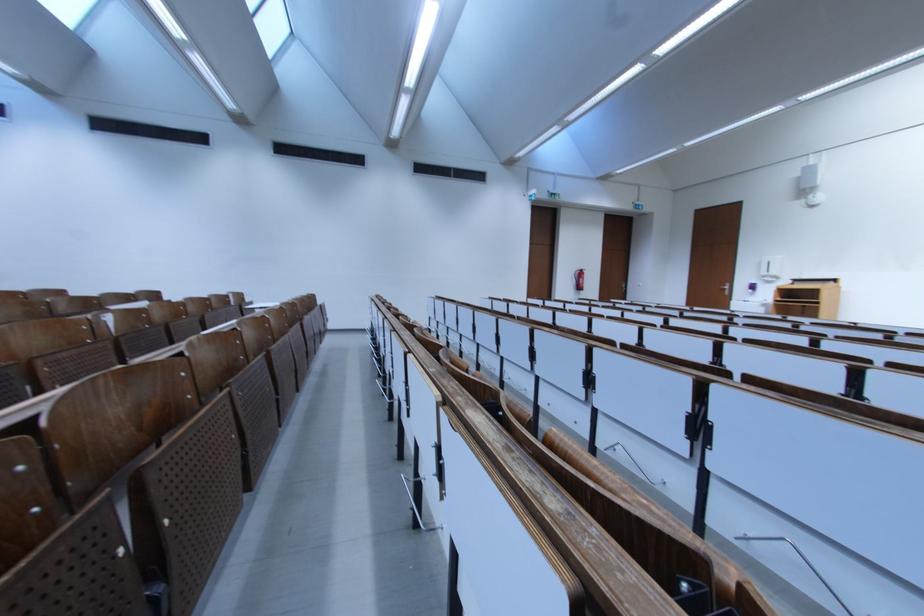
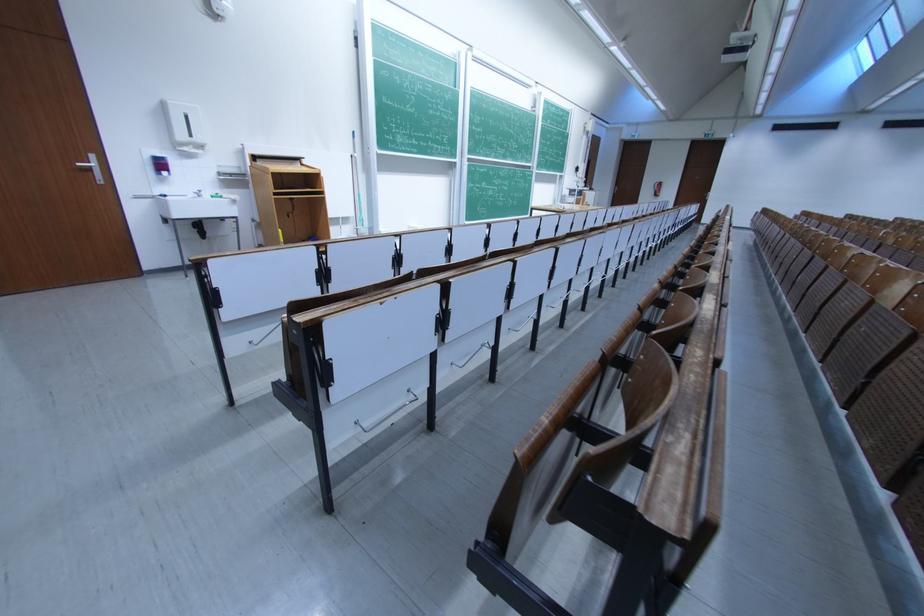
Locate, in the second image, the point that corresponds to point (782, 276) in the first image.

(205, 142)